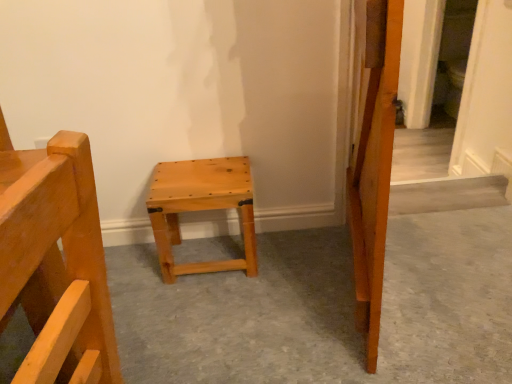
Question: Is point (208, 182) closer or farther from the camera than point (507, 329)?

Choices:
 (A) farther
 (B) closer

Answer: (A)

Question: Would you say natural wood stool at center is to the left or to the right of natural wood stool at center in the picture?

Choices:
 (A) right
 (B) left

Answer: (B)

Question: In terms of width, does natural wood stool at center look wider or thinner when compared to natural wood stool at center?

Choices:
 (A) thin
 (B) wide

Answer: (A)

Question: In terms of size, does natural wood stool at center appear bigger or smaller than natural wood stool at center?

Choices:
 (A) big
 (B) small

Answer: (A)

Question: From the image's perspective, is natural wood stool at center above or below natural wood stool at center?

Choices:
 (A) above
 (B) below

Answer: (B)

Question: Looking at their shapes, would you say natural wood stool at center is wider or thinner than natural wood stool at center?

Choices:
 (A) thin
 (B) wide

Answer: (B)

Question: Is natural wood stool at center taller or shorter than natural wood stool at center?

Choices:
 (A) short
 (B) tall

Answer: (A)